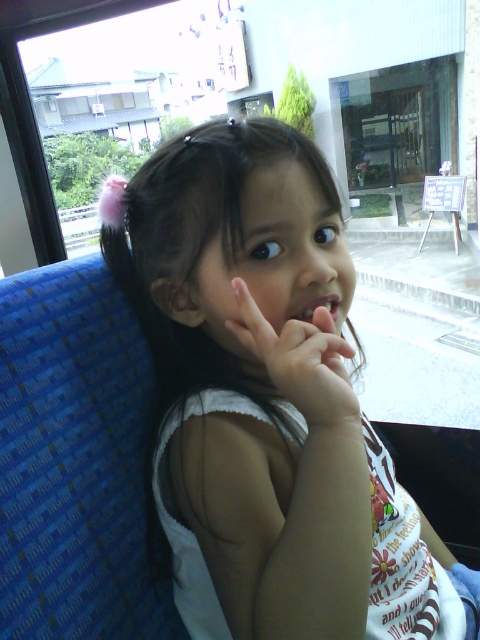
Consider the image. Is white fabric shirt at center positioned in front of white matte hand at center?

Yes.

Who is more distant from viewer, (356, 340) or (326, 396)?

The point (356, 340) is behind.

Is point (103, 193) positioned after point (313, 420)?

Yes.

I want to click on white fabric shirt at center, so click(x=266, y=403).

From the picture: Between white matte hand at center and matte pink lips at center, which one is positioned higher?

matte pink lips at center is above.

Is white matte hand at center bigger than matte pink lips at center?

Correct, white matte hand at center is larger in size than matte pink lips at center.

Is point (313, 324) closer to viewer compared to point (291, 316)?

Yes, it is in front of point (291, 316).

This screenshot has height=640, width=480. Find the location of `white matte hand at center`. white matte hand at center is located at coordinates (300, 360).

Between white fabric shirt at center and matte pink lips at center, which one has less height?

Standing shorter between the two is matte pink lips at center.

Which is in front, point (276, 173) or point (301, 317)?

Point (276, 173) is more forward.

The height and width of the screenshot is (640, 480). In order to click on white fabric shirt at center in this screenshot , I will do `click(266, 403)`.